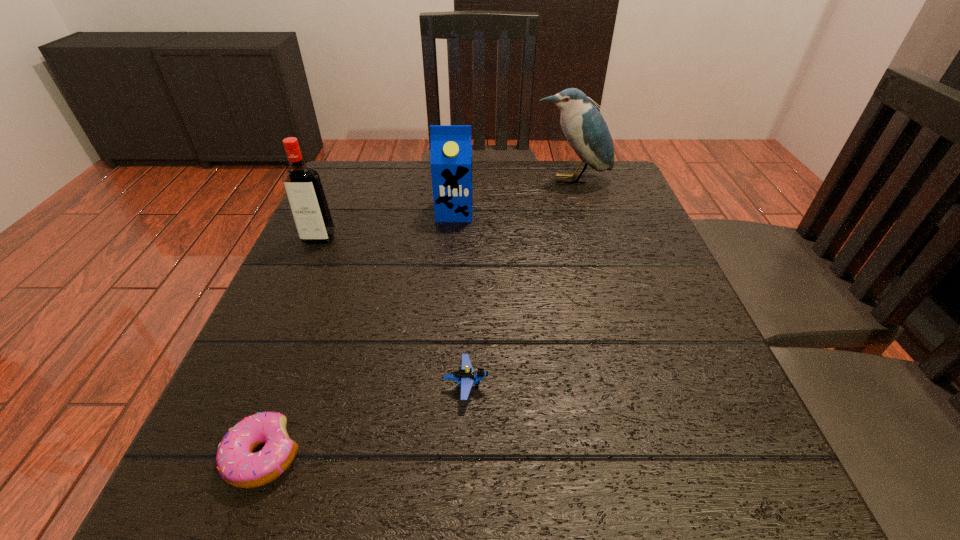
Find the location of a particular element. The width and height of the screenshot is (960, 540). bird is located at coordinates (584, 127).

Image resolution: width=960 pixels, height=540 pixels. I want to click on the farthest object, so click(584, 127).

Locate an element on the screen. The height and width of the screenshot is (540, 960). the third farthest object is located at coordinates (302, 184).

Identify the location of carton. The image size is (960, 540). (451, 146).

I want to click on the fourth farthest object, so click(x=465, y=376).

The height and width of the screenshot is (540, 960). Identify the location of doughnut. (237, 465).

This screenshot has width=960, height=540. I want to click on the nearest object, so click(x=237, y=465).

Identify the location of vacant area situated at the tip of the rightmost object's beak. (578, 202).

The height and width of the screenshot is (540, 960). I want to click on free space located 0.320m on the front and back of the vodka, so click(260, 369).

This screenshot has height=540, width=960. In order to click on vacant space located with the cap open on the carton in this screenshot , I will do `click(445, 333)`.